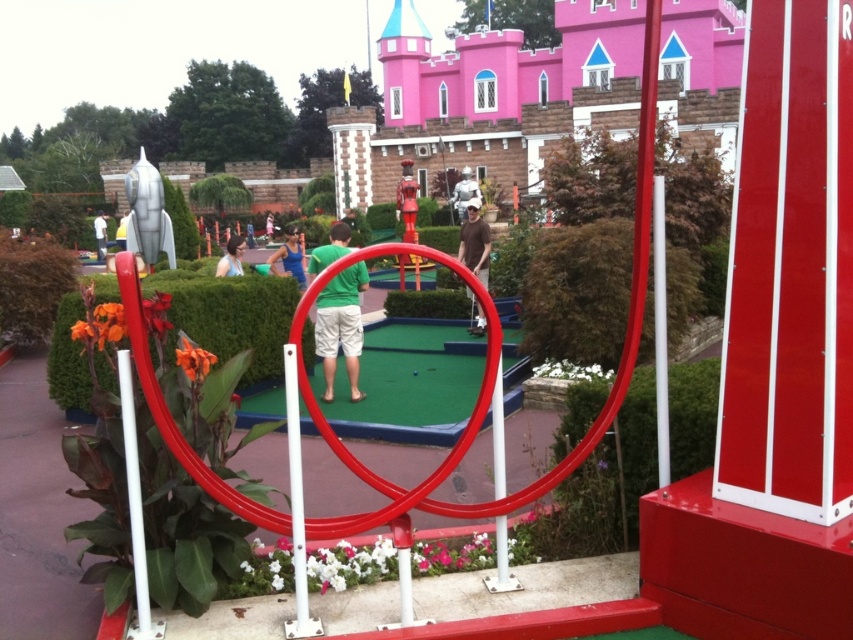
Question: Does white plastic pole at lower left appear over blue fabric shirt at center?

Choices:
 (A) yes
 (B) no

Answer: (B)

Question: Which point is farther from the camera taking this photo?

Choices:
 (A) (144, 596)
 (B) (332, 253)
 (C) (474, 253)
 (D) (280, 273)

Answer: (D)

Question: Which object is positioned farthest from the green artificial turf at center?

Choices:
 (A) blue fabric shirt at center
 (B) brown matte shirt at center
 (C) green fabric shirt at center

Answer: (C)

Question: Can you confirm if green artificial turf at center is positioned to the right of blue fabric shirt at center?

Choices:
 (A) no
 (B) yes

Answer: (B)

Question: Among these points, which one is farthest from the camera?

Choices:
 (A) (224, 266)
 (B) (415, 369)

Answer: (A)

Question: Is blue fabric shirt at center bigger than matte blue shirt at center?

Choices:
 (A) no
 (B) yes

Answer: (B)